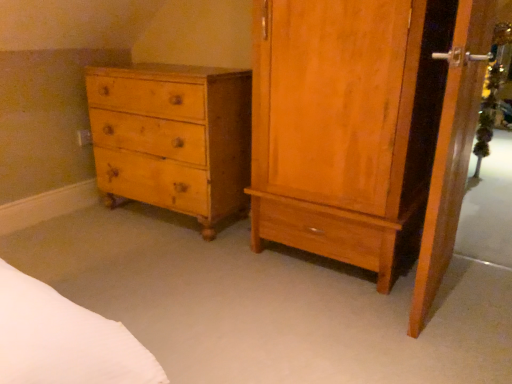
The image size is (512, 384). Identify the location of vacant space in front of wooden screen door at right. (451, 342).